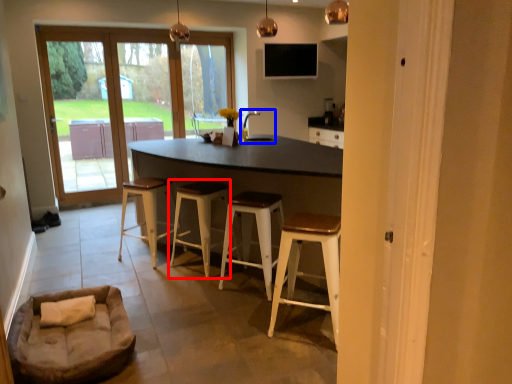
Question: Among these objects, which one is farthest to the camera, stool (highlighted by a red box) or sink (highlighted by a blue box)?

Choices:
 (A) stool
 (B) sink

Answer: (B)